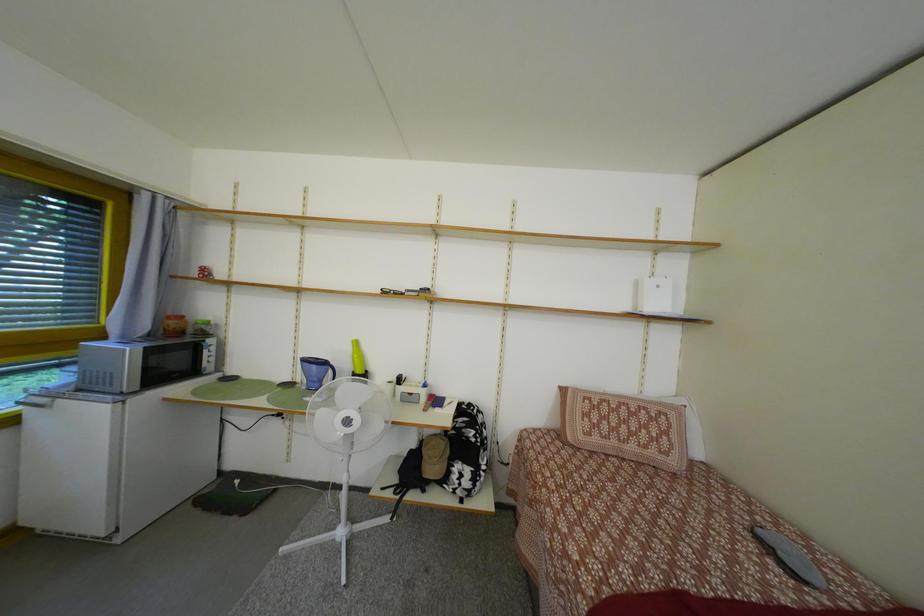
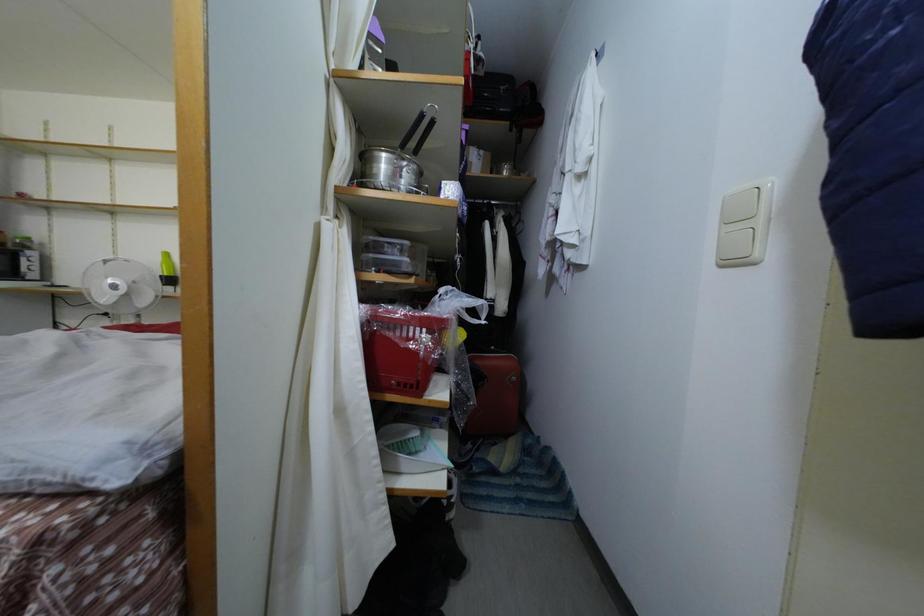
The images are taken continuously from a first-person perspective. In which direction are you moving?

The cameraman moved toward right, backward.